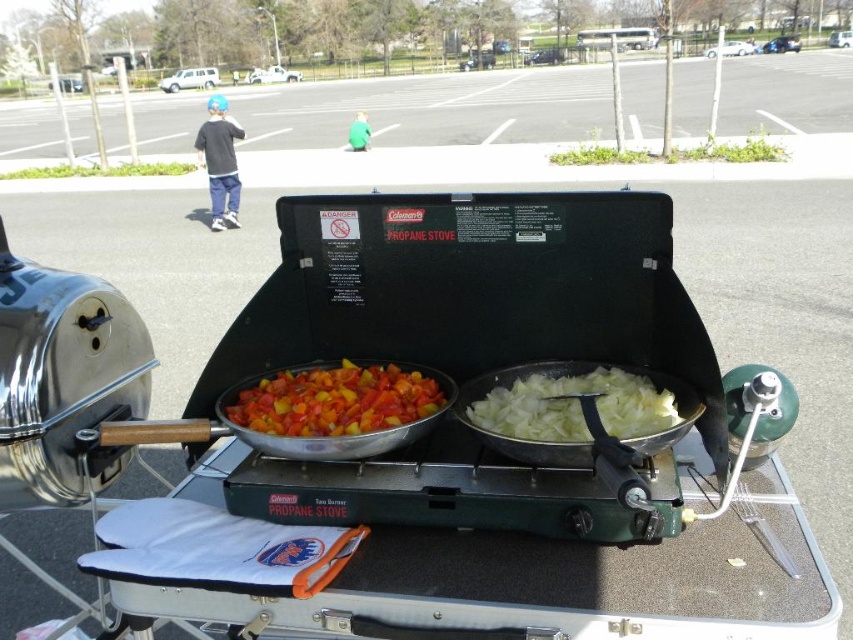
You are setting up a portable cooking station and need to arrange the pans based on their sizes. Given the vividly colored vegetables at center and the white translucent onions at right, which pan should you place first if you want to start with the wider one?

The vividly colored vegetables at center has a larger width than the white translucent onions at right, so you should place the pan with the vividly colored vegetables at center first.

You are a chef preparing a meal and need to quickly access the white translucent onions at right. Given their position relative to the vividly colored vegetables at center, which direction should you move to reach them?

The white translucent onions at right are behind the vividly colored vegetables at center. To reach them, you should move backward away from the vividly colored vegetables at center.

You are setting up a cooking station on the tailgate. You need to know the position of the vividly colored vegetables at center and white translucent onions at right. Which one is lower in the image?

The vividly colored vegetables at center is below white translucent onions at right, so the vividly colored vegetables at center is lower in the image.